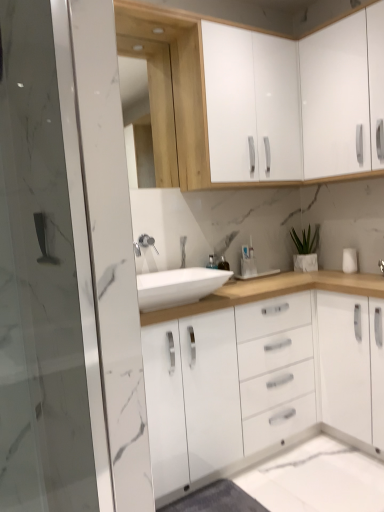
Question: From the image's perspective, is satin nickel faucet at center on top of white glossy sink at center?

Choices:
 (A) no
 (B) yes

Answer: (B)

Question: Is satin nickel faucet at center oriented away from white glossy sink at center?

Choices:
 (A) yes
 (B) no

Answer: (B)

Question: From a real-world perspective, is satin nickel faucet at center positioned under white glossy sink at center based on gravity?

Choices:
 (A) no
 (B) yes

Answer: (A)

Question: From the image's perspective, is satin nickel faucet at center below white glossy sink at center?

Choices:
 (A) no
 (B) yes

Answer: (A)

Question: Is satin nickel faucet at center far away from white glossy sink at center?

Choices:
 (A) no
 (B) yes

Answer: (A)

Question: Is satin nickel faucet at center not inside white glossy sink at center?

Choices:
 (A) no
 (B) yes

Answer: (B)

Question: From a real-world perspective, is satin nickel faucet at center on top of transparent glass screen door at left?

Choices:
 (A) no
 (B) yes

Answer: (A)

Question: Does satin nickel faucet at center have a larger size compared to transparent glass screen door at left?

Choices:
 (A) yes
 (B) no

Answer: (B)

Question: Would you say transparent glass screen door at left is part of satin nickel faucet at center's contents?

Choices:
 (A) no
 (B) yes

Answer: (A)

Question: From the image's perspective, is satin nickel faucet at center below transparent glass screen door at left?

Choices:
 (A) no
 (B) yes

Answer: (A)

Question: Considering the relative positions of satin nickel faucet at center and transparent glass screen door at left in the image provided, is satin nickel faucet at center to the left of transparent glass screen door at left from the viewer's perspective?

Choices:
 (A) no
 (B) yes

Answer: (A)

Question: Does satin nickel faucet at center turn towards transparent glass screen door at left?

Choices:
 (A) yes
 (B) no

Answer: (B)

Question: Does white glossy cabinet at upper right, acting as the first cabinetry starting from the right, come behind white matte plant at upper right?

Choices:
 (A) no
 (B) yes

Answer: (A)